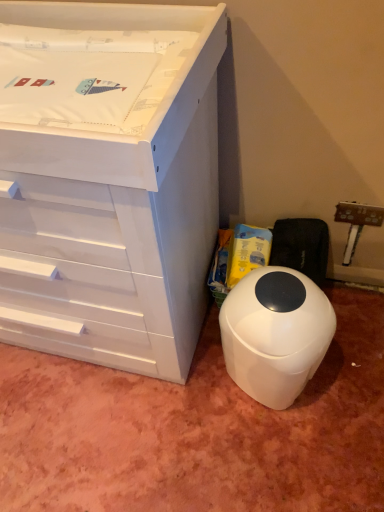
Question: Should I look upward or downward to see white plastic waste bin at lower right?

Choices:
 (A) up
 (B) down

Answer: (B)

Question: Considering the relative sizes of white plastic waste bin at lower right and white glossy chest of drawers at upper left in the image provided, is white plastic waste bin at lower right thinner than white glossy chest of drawers at upper left?

Choices:
 (A) no
 (B) yes

Answer: (B)

Question: From the image's perspective, would you say white plastic waste bin at lower right is shown under white glossy chest of drawers at upper left?

Choices:
 (A) yes
 (B) no

Answer: (A)

Question: Considering the relative sizes of white plastic waste bin at lower right and white glossy chest of drawers at upper left in the image provided, is white plastic waste bin at lower right taller than white glossy chest of drawers at upper left?

Choices:
 (A) no
 (B) yes

Answer: (A)

Question: From a real-world perspective, does white plastic waste bin at lower right stand above white glossy chest of drawers at upper left?

Choices:
 (A) no
 (B) yes

Answer: (A)

Question: From the image's perspective, is white plastic waste bin at lower right on top of white glossy chest of drawers at upper left?

Choices:
 (A) yes
 (B) no

Answer: (B)

Question: From a real-world perspective, is white plastic waste bin at lower right beneath white glossy chest of drawers at upper left?

Choices:
 (A) yes
 (B) no

Answer: (A)

Question: Can we say white glossy chest of drawers at upper left lies outside white plastic waste bin at lower right?

Choices:
 (A) no
 (B) yes

Answer: (B)

Question: Is white plastic waste bin at lower right inside white glossy chest of drawers at upper left?

Choices:
 (A) no
 (B) yes

Answer: (A)

Question: Considering the relative positions of white glossy chest of drawers at upper left and white plastic waste bin at lower right in the image provided, is white glossy chest of drawers at upper left in front of white plastic waste bin at lower right?

Choices:
 (A) yes
 (B) no

Answer: (A)

Question: From a real-world perspective, is white glossy chest of drawers at upper left beneath white plastic waste bin at lower right?

Choices:
 (A) yes
 (B) no

Answer: (B)

Question: Can you confirm if white glossy chest of drawers at upper left is wider than white plastic waste bin at lower right?

Choices:
 (A) no
 (B) yes

Answer: (B)

Question: Considering the relative sizes of white glossy chest of drawers at upper left and white plastic waste bin at lower right in the image provided, is white glossy chest of drawers at upper left shorter than white plastic waste bin at lower right?

Choices:
 (A) no
 (B) yes

Answer: (A)

Question: Is white glossy chest of drawers at upper left inside the boundaries of white plastic waste bin at lower right, or outside?

Choices:
 (A) outside
 (B) inside

Answer: (A)